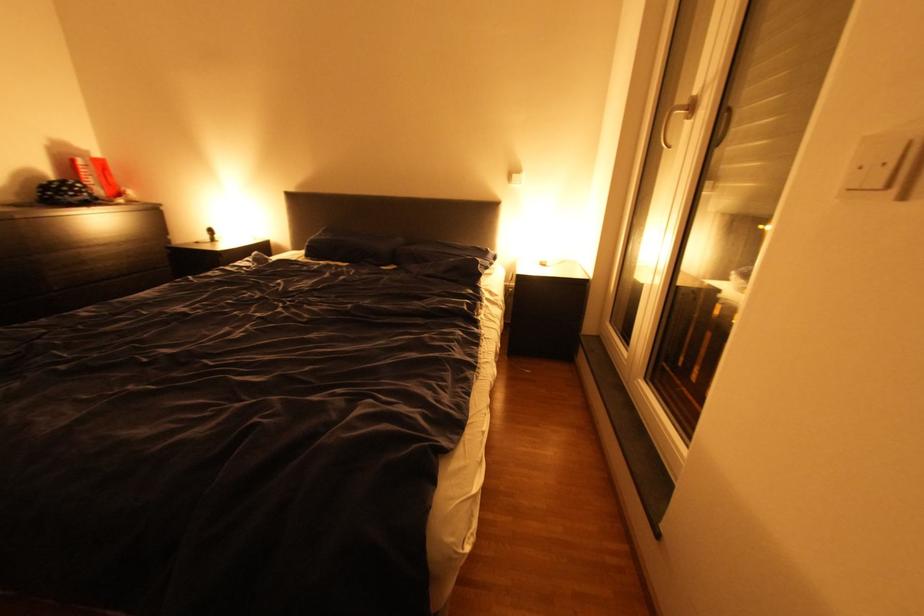
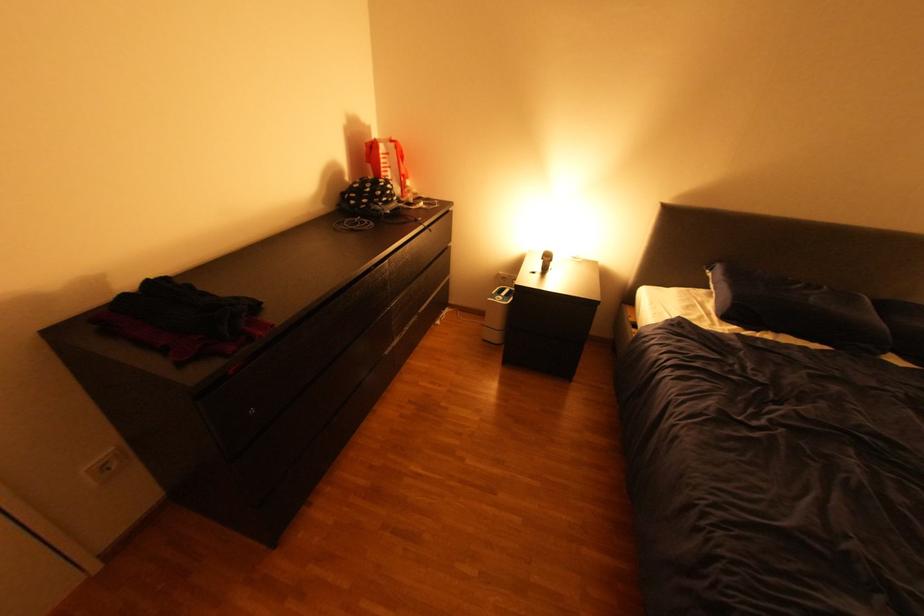
Find the pixel in the second image that matches point (225, 236) in the first image.

(561, 262)